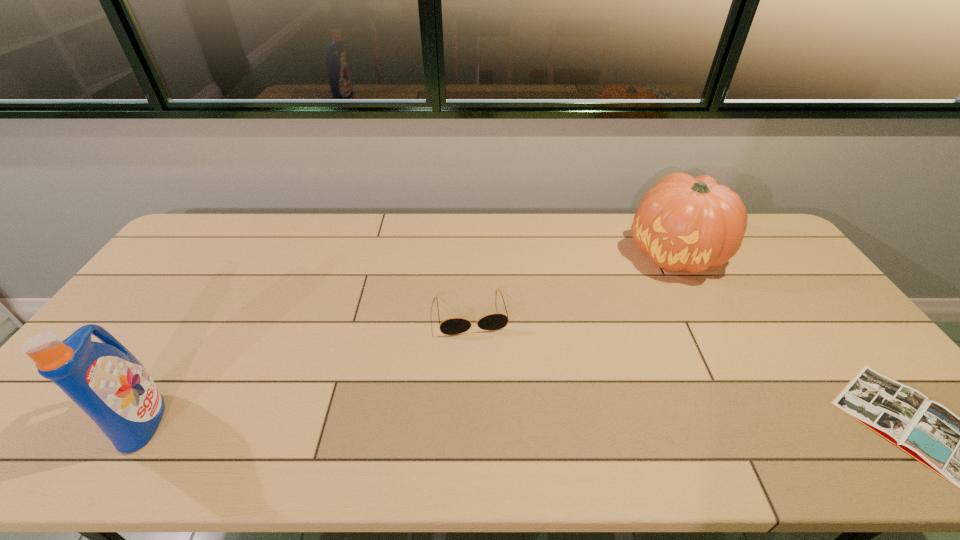
This screenshot has height=540, width=960. In order to click on the leftmost object in this screenshot , I will do `click(105, 380)`.

Where is `the tallest object`? This screenshot has width=960, height=540. the tallest object is located at coordinates (105, 380).

Locate an element on the screen. Image resolution: width=960 pixels, height=540 pixels. the second shortest object is located at coordinates (496, 321).

Where is `the second farthest object`? The image size is (960, 540). the second farthest object is located at coordinates (496, 321).

Where is `pumpkin`? This screenshot has height=540, width=960. pumpkin is located at coordinates (683, 223).

Where is `the second object from right to left`? Image resolution: width=960 pixels, height=540 pixels. the second object from right to left is located at coordinates (683, 223).

Where is `free space located 0.140m on the label of the leftmost object`? The width and height of the screenshot is (960, 540). free space located 0.140m on the label of the leftmost object is located at coordinates (224, 419).

Where is `vacant position located 0.150m on the front-facing side of the sunglasses`? vacant position located 0.150m on the front-facing side of the sunglasses is located at coordinates (484, 381).

I want to click on vacant area located on the front-facing side of the sunglasses, so click(x=483, y=372).

What are the coordinates of `vacant space located 0.160m on the front-facing side of the sunglasses` in the screenshot? It's located at (485, 384).